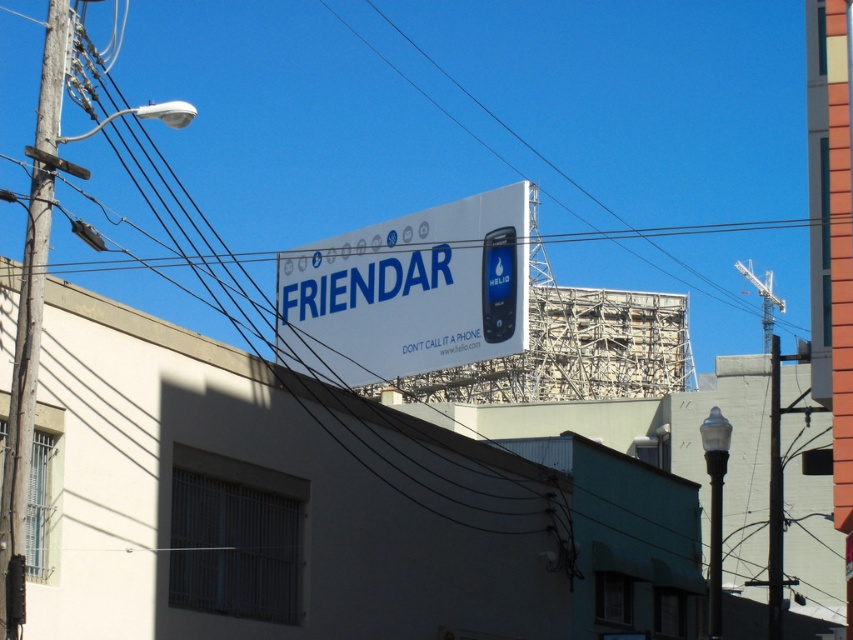
Question: Which object is farther from the camera taking this photo?

Choices:
 (A) wooden utility pole at left
 (B) black wire at upper center

Answer: (B)

Question: Can you confirm if black wire at upper center is thinner than white matte signboard at center?

Choices:
 (A) yes
 (B) no

Answer: (B)

Question: Which of the following is the closest to the observer?

Choices:
 (A) (38, 150)
 (B) (288, 307)

Answer: (A)

Question: Can you confirm if black wire at upper center is wider than white matte signboard at center?

Choices:
 (A) yes
 (B) no

Answer: (A)

Question: Considering the real-world distances, which object is farthest from the white matte signboard at center?

Choices:
 (A) black wire at upper center
 (B) wooden utility pole at left

Answer: (A)

Question: Is the position of white matte signboard at center more distant than that of wooden utility pole at left?

Choices:
 (A) yes
 (B) no

Answer: (A)